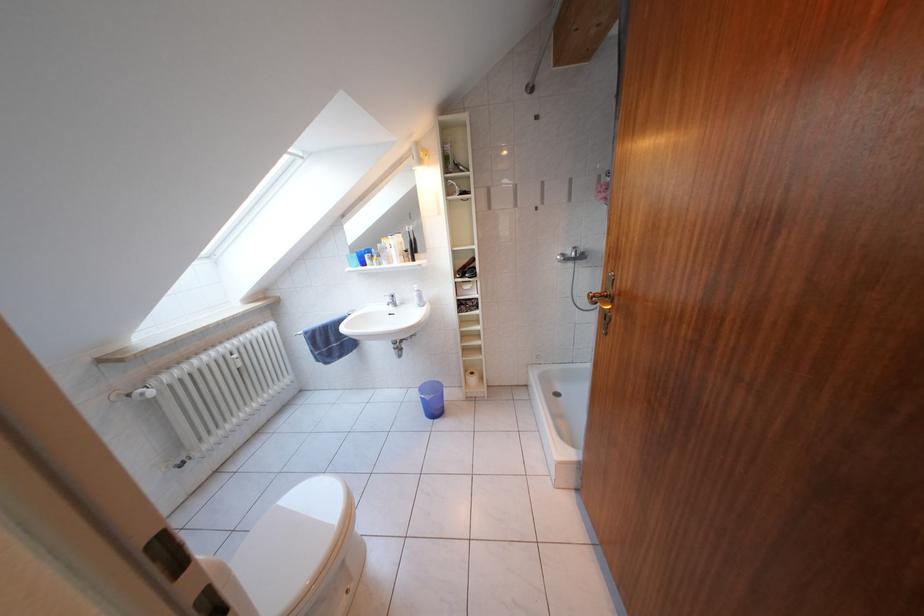
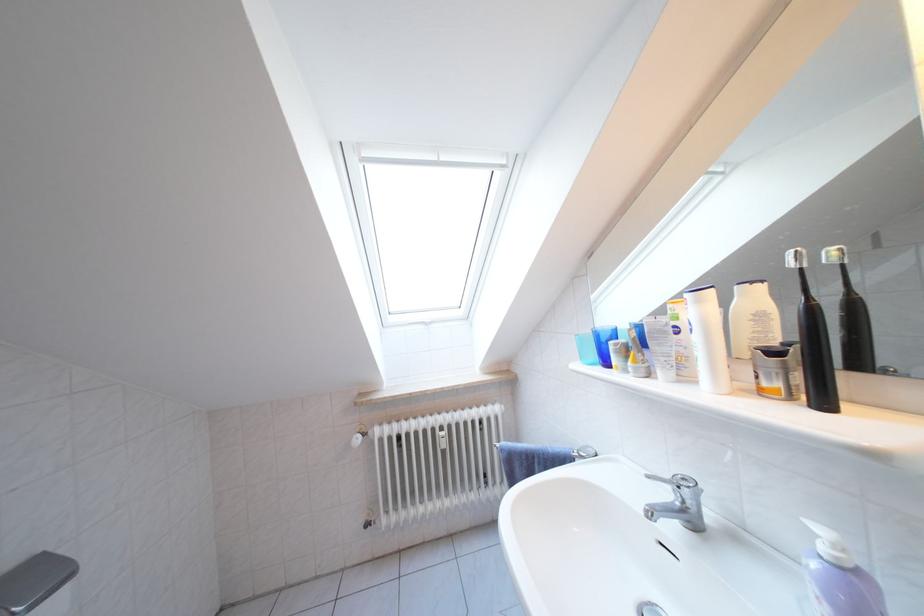
Locate, in the second image, the point that corresponds to [415,256] in the first image.

(783, 359)